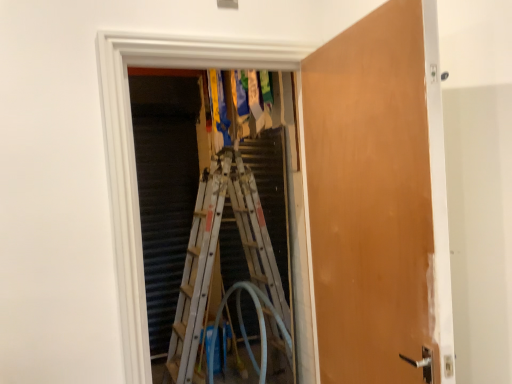
Question: Would you say wooden door at center contains white metallic ladder at center?

Choices:
 (A) no
 (B) yes

Answer: (A)

Question: Does wooden door at center have a lesser height compared to white metallic ladder at center?

Choices:
 (A) yes
 (B) no

Answer: (A)

Question: Is wooden door at center taller than white metallic ladder at center?

Choices:
 (A) yes
 (B) no

Answer: (B)

Question: Is wooden door at center closer to the viewer compared to white metallic ladder at center?

Choices:
 (A) no
 (B) yes

Answer: (B)

Question: Is wooden door at center at the left side of white metallic ladder at center?

Choices:
 (A) no
 (B) yes

Answer: (A)

Question: Does wooden door at center appear on the right side of white metallic ladder at center?

Choices:
 (A) no
 (B) yes

Answer: (B)

Question: Can we say white metallic ladder at center lies outside translucent rubber garden hose at center?

Choices:
 (A) no
 (B) yes

Answer: (B)

Question: Does white metallic ladder at center have a greater width compared to translucent rubber garden hose at center?

Choices:
 (A) no
 (B) yes

Answer: (A)

Question: Does white metallic ladder at center touch translucent rubber garden hose at center?

Choices:
 (A) no
 (B) yes

Answer: (A)

Question: Can you confirm if white metallic ladder at center is thinner than translucent rubber garden hose at center?

Choices:
 (A) no
 (B) yes

Answer: (B)

Question: From a real-world perspective, is white metallic ladder at center beneath translucent rubber garden hose at center?

Choices:
 (A) yes
 (B) no

Answer: (B)

Question: From a real-world perspective, is white metallic ladder at center on translucent rubber garden hose at center?

Choices:
 (A) yes
 (B) no

Answer: (A)

Question: Is there a large distance between translucent rubber garden hose at center and wooden door at center?

Choices:
 (A) yes
 (B) no

Answer: (A)